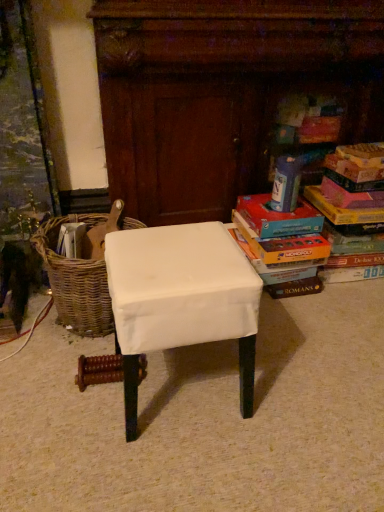
The image size is (384, 512). In order to click on free space in front of woven brown basket at left in this screenshot , I will do `click(51, 389)`.